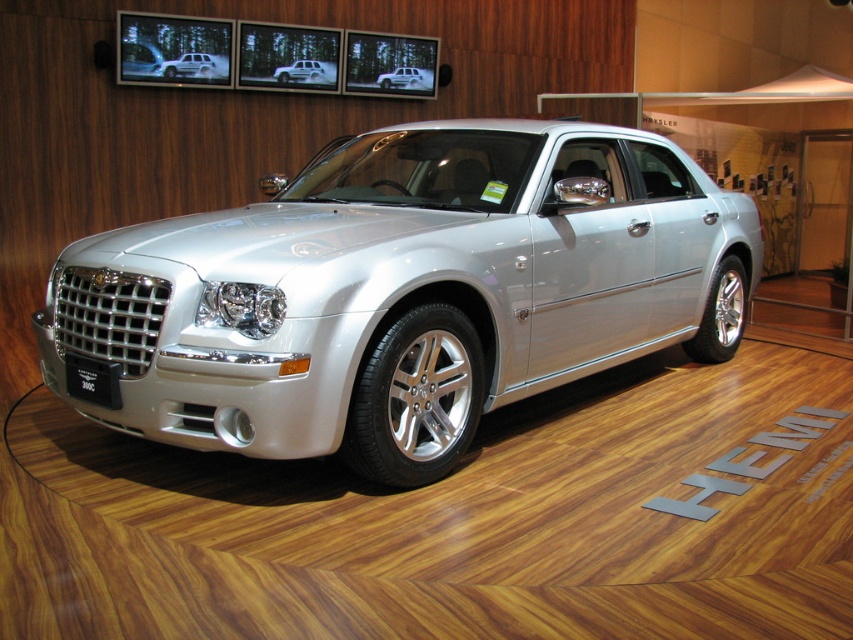
Is black metallic license plate at front positioned behind satin silver metallic sedan at upper center?

No, black metallic license plate at front is in front of satin silver metallic sedan at upper center.

Which of these two, black metallic license plate at front or satin silver metallic sedan at upper center, stands taller?

satin silver metallic sedan at upper center

Which is in front, point (102, 385) or point (212, 61)?

Point (102, 385) is more forward.

Where is `black metallic license plate at front`? black metallic license plate at front is located at coordinates (91, 380).

Does satin silver car at center appear on the right side of silver metallic sedan at center?

No, satin silver car at center is not to the right of silver metallic sedan at center.

Which is more to the left, satin silver car at center or silver metallic sedan at center?

satin silver car at center is more to the left.

Where is `satin silver car at center`? This screenshot has width=853, height=640. satin silver car at center is located at coordinates (306, 72).

Does black metallic license plate at front appear on the left side of silver metallic sedan at center?

Correct, you'll find black metallic license plate at front to the left of silver metallic sedan at center.

Is black metallic license plate at front in front of silver metallic sedan at center?

Yes.

Is point (68, 385) closer to viewer compared to point (380, 74)?

Yes, it is.

Where is `black metallic license plate at front`? black metallic license plate at front is located at coordinates (91, 380).